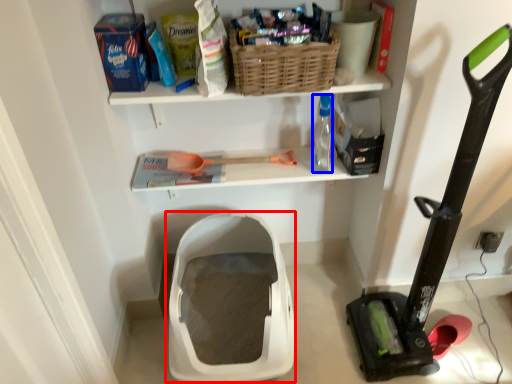
Question: Which object is closer to the camera taking this photo, storage box (highlighted by a red box) or bottle (highlighted by a blue box)?

Choices:
 (A) storage box
 (B) bottle

Answer: (A)